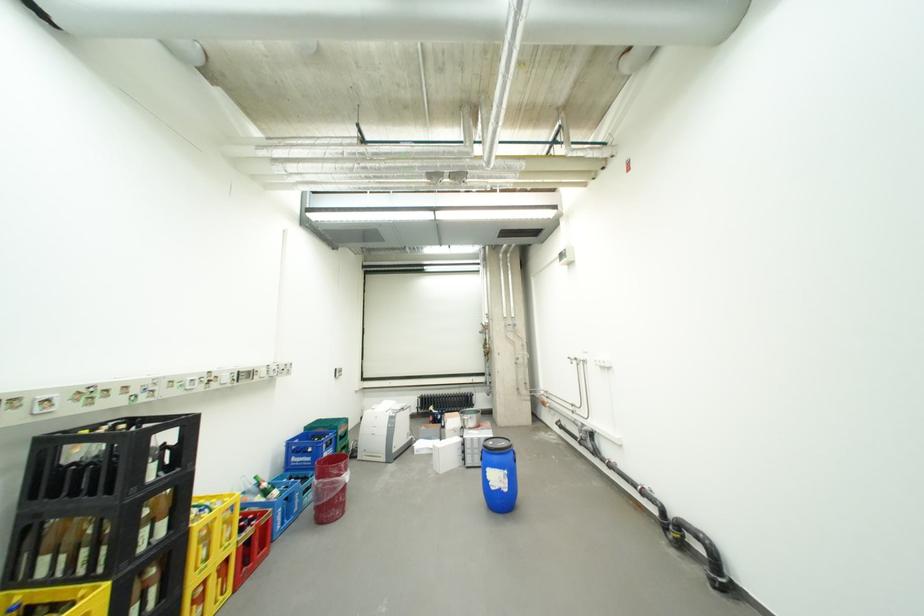
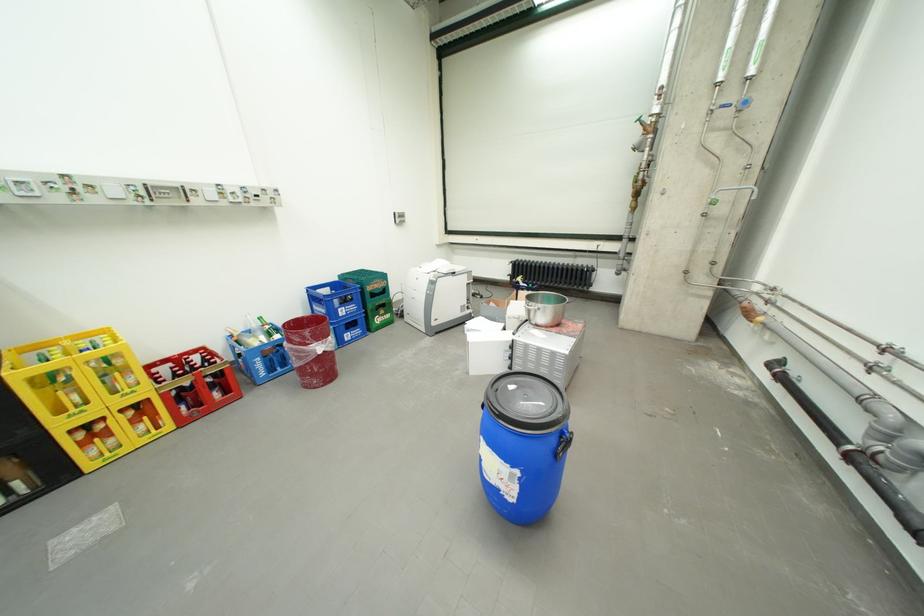
Where in the second image is the point corresponding to [473,418] from the first image?

(540, 304)